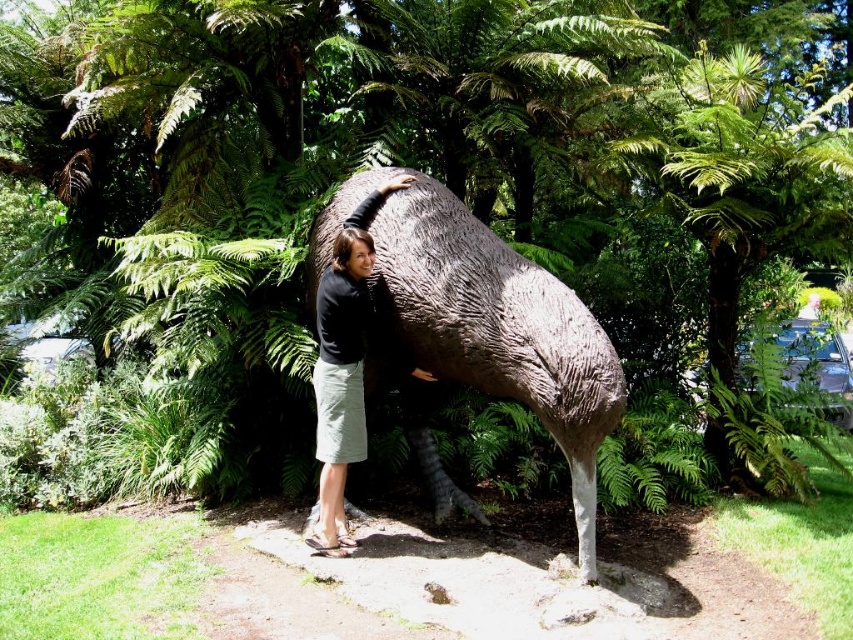
Image resolution: width=853 pixels, height=640 pixels. What do you see at coordinates (492, 330) in the screenshot?
I see `rough textured statue at center` at bounding box center [492, 330].

Describe the element at coordinates (492, 330) in the screenshot. The width and height of the screenshot is (853, 640). I see `rough textured statue at center` at that location.

This screenshot has height=640, width=853. Find the location of `rough textured statue at center`. rough textured statue at center is located at coordinates (492, 330).